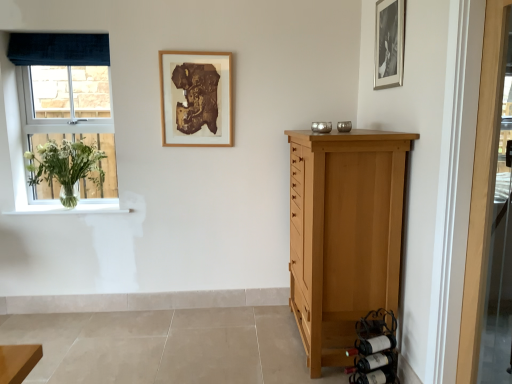
Find the location of a particular element. free spot above white glossy window sill at left (from a real-world perspective) is located at coordinates (68, 206).